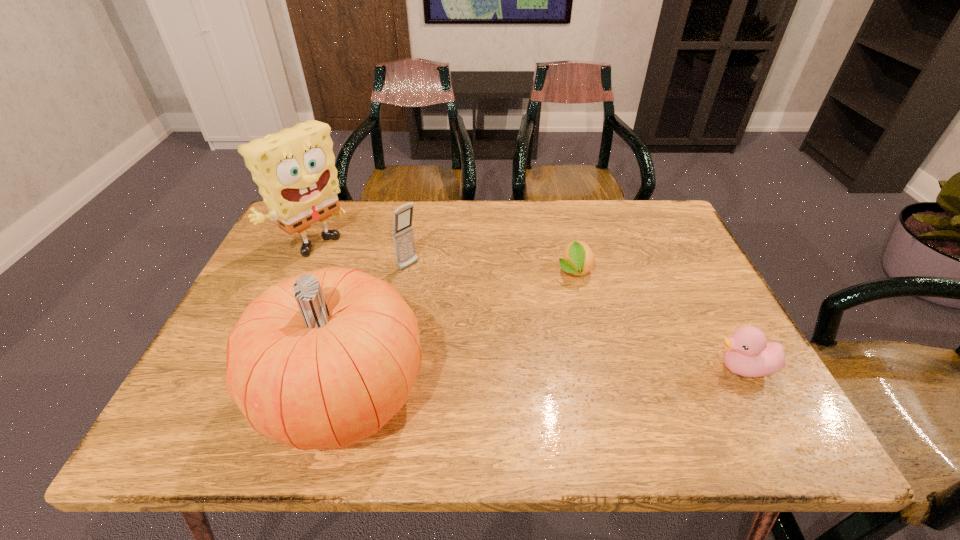
In the image, there is a desktop. Where is `free space at the far edge`? free space at the far edge is located at coordinates (444, 207).

In the image, there is a desktop. At what (x,y) coordinates should I click in order to perform the action: click on vacant space at the near edge. Please return your answer as a coordinate pair (x, y). Looking at the image, I should click on (574, 397).

The image size is (960, 540). I want to click on free region at the left edge of the desktop, so click(255, 282).

In the image, there is a desktop. Identify the location of free space at the right edge. (670, 336).

I want to click on vacant space at the far right corner of the desktop, so click(652, 247).

Locate an element on the screen. vacant space at the near right corner of the desktop is located at coordinates (716, 383).

Identify the location of vacant area between the pumpkin and the duckling. (543, 381).

This screenshot has height=540, width=960. Identify the location of free spot between the pumpkin and the duckling. (543, 381).

Find the location of a particular element. The height and width of the screenshot is (540, 960). free spot between the lemon and the pumpkin is located at coordinates (459, 333).

You are a GUI agent. You are given a task and a screenshot of the screen. Output one action in this format:
    pyautogui.click(x=<x>, y=<y>)
    Task: Click on the free space between the pumpkin and the rightmost object
    The width and height of the screenshot is (960, 540).
    Given the screenshot: What is the action you would take?
    pyautogui.click(x=543, y=381)